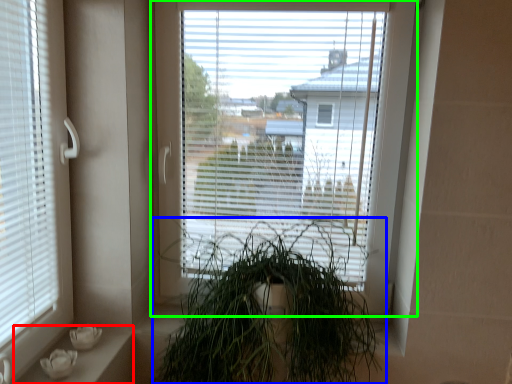
Question: Which object is the farthest from window sill (highlighted by a red box)? Choose among these: houseplant (highlighted by a blue box) or window (highlighted by a green box).

Choices:
 (A) houseplant
 (B) window

Answer: (B)